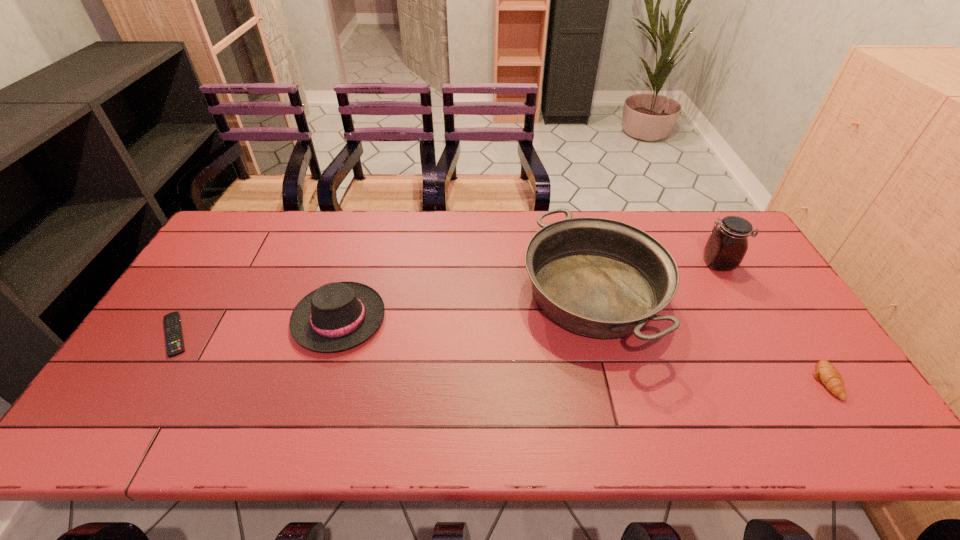
Image resolution: width=960 pixels, height=540 pixels. I want to click on vacant space that satisfies the following two spatial constraints: 1. on the lid of the fourth object from left to right; 2. on the left side of the crescent roll, so click(785, 381).

Find the location of a particular element. The image size is (960, 540). vacant space that satisfies the following two spatial constraints: 1. on the front side of the fourth object from right to left; 2. on the right side of the crescent roll is located at coordinates (321, 381).

The width and height of the screenshot is (960, 540). I want to click on vacant region that satisfies the following two spatial constraints: 1. on the lid of the jar; 2. on the right side of the second shortest object, so click(x=785, y=381).